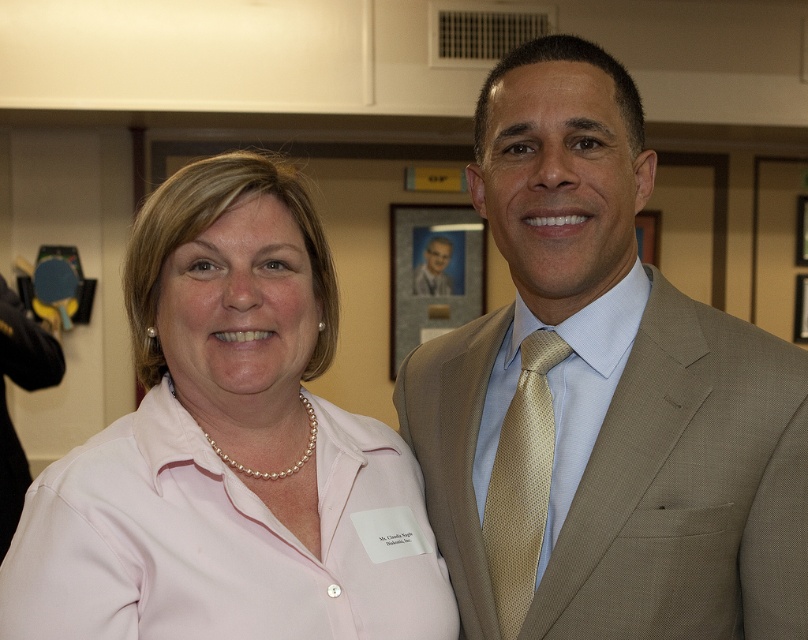
From the picture: Does tan textured suit at center appear over gold textured tie at right?

Yes, tan textured suit at center is above gold textured tie at right.

Between tan textured suit at center and gold textured tie at right, which one appears on the left side from the viewer's perspective?

Positioned to the left is gold textured tie at right.

The height and width of the screenshot is (640, 808). In order to click on tan textured suit at center in this screenshot , I will do `click(602, 397)`.

Can you confirm if pink satin blouse at center is smaller than light blue shirt at center?

No.

Between point (426, 561) and point (449, 241), which one is positioned in front?

Point (426, 561) is more forward.

Is point (141, 260) positioned after point (427, 262)?

No, (141, 260) is in front of (427, 262).

I want to click on pink satin blouse at center, so click(x=229, y=449).

Locate an element on the screen. This screenshot has height=640, width=808. pink satin blouse at center is located at coordinates (229, 449).

Which is below, pink satin blouse at center or gold textured tie at right?

gold textured tie at right

Describe the element at coordinates (229, 449) in the screenshot. I see `pink satin blouse at center` at that location.

Locate an element on the screen. The width and height of the screenshot is (808, 640). pink satin blouse at center is located at coordinates (229, 449).